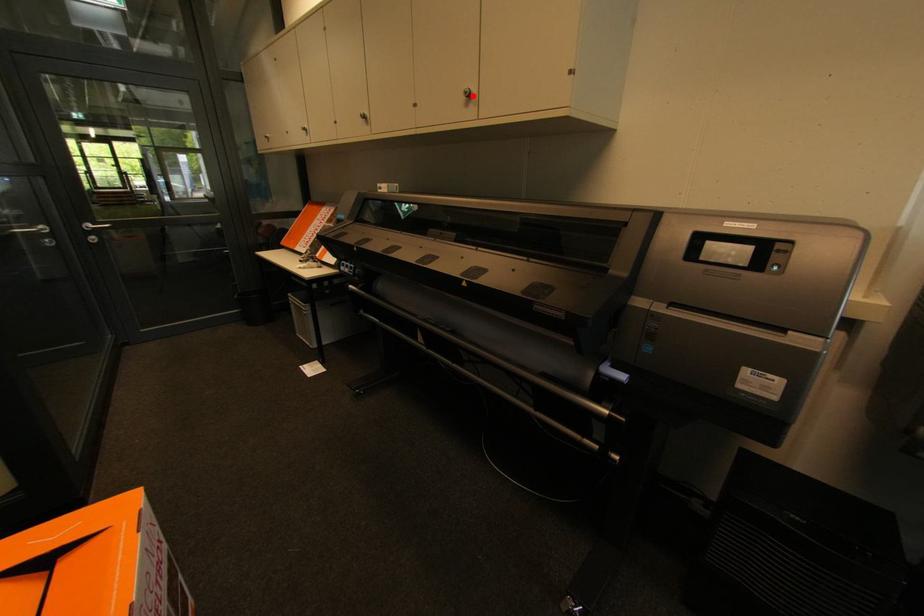
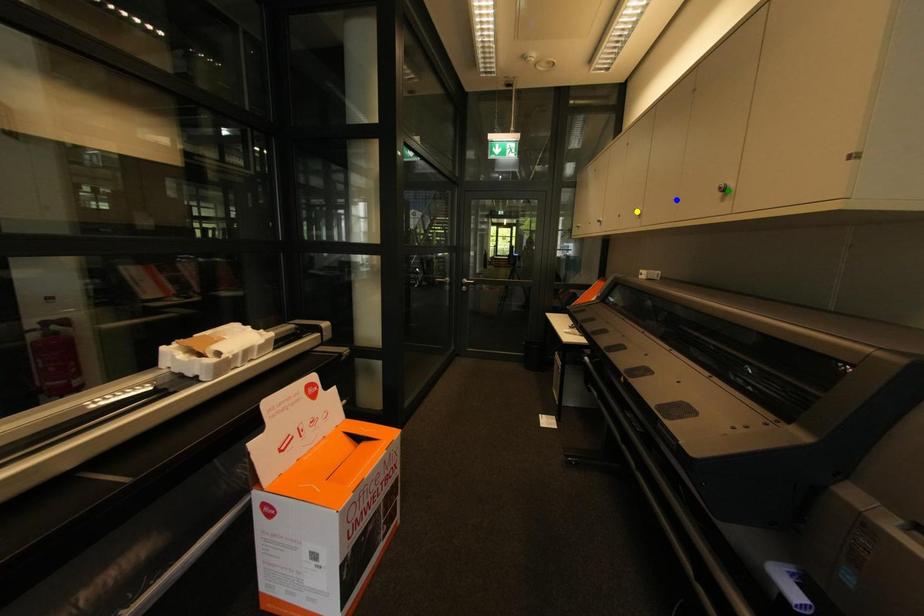
Question: I am providing you with two images of the same scene from different viewpoints. A red point is marked on the first image. You are given multiple points on the second image. Which point in image 2 is actually the same real-world point as the red point in image 1?

Choices:
 (A) green point
 (B) yellow point
 (C) blue point

Answer: (A)